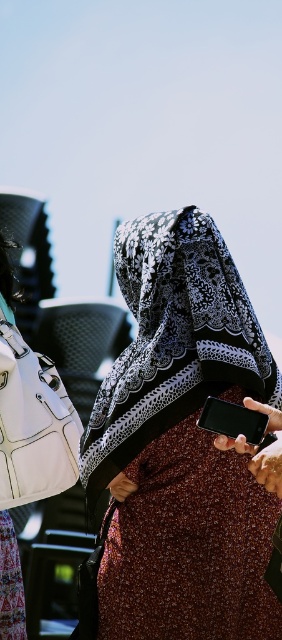
Does patterned fabric headscarf at center appear on the right side of brown textured dress at center?

No, patterned fabric headscarf at center is not to the right of brown textured dress at center.

Which is behind, point (241, 564) or point (172, 452)?

The point (172, 452) is behind.

Where is `patterned fabric headscarf at center`? This screenshot has height=640, width=282. patterned fabric headscarf at center is located at coordinates (181, 445).

Is point (190, 445) positioned in front of point (223, 406)?

No, (190, 445) is behind (223, 406).

Does brown textured dress at center have a larger size compared to black glossy smartphone at lower right?

Yes.

Image resolution: width=282 pixels, height=640 pixels. In order to click on brown textured dress at center in this screenshot , I will do `click(192, 541)`.

Who is higher up, patterned fabric headscarf at center or black glossy smartphone at lower right?

black glossy smartphone at lower right is higher up.

Find the location of a particular element. The image size is (282, 640). patterned fabric headscarf at center is located at coordinates (181, 445).